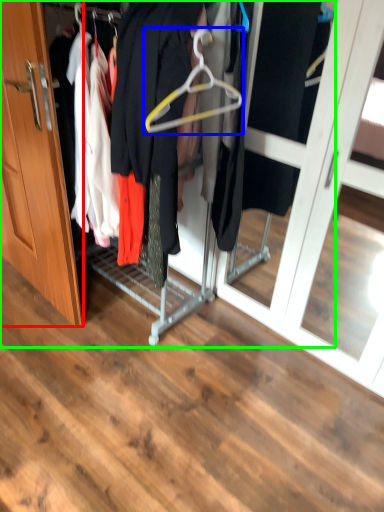
Question: Considering the real-world distances, which object is farthest from door (highlighted by a red box)? hanger (highlighted by a blue box) or closet (highlighted by a green box)?

Choices:
 (A) hanger
 (B) closet

Answer: (A)